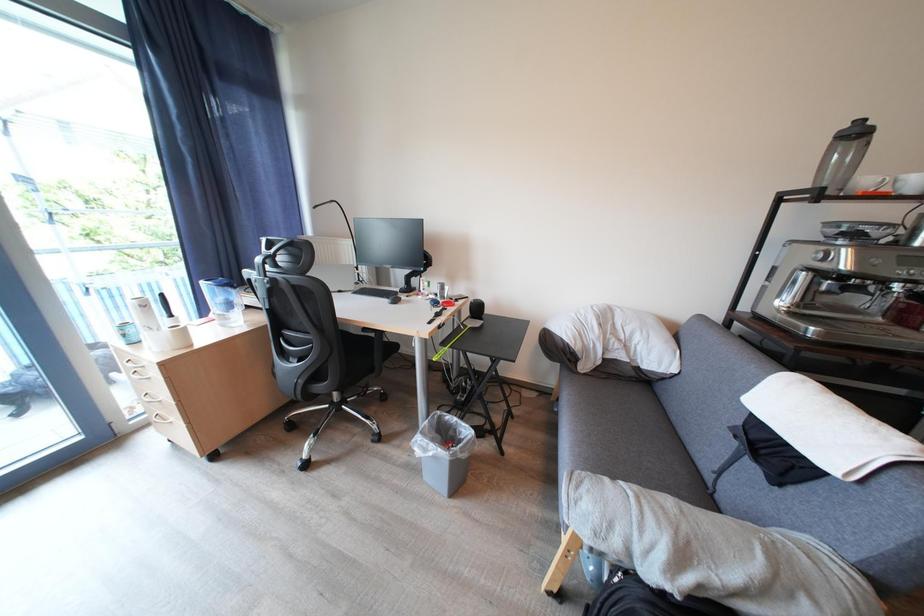
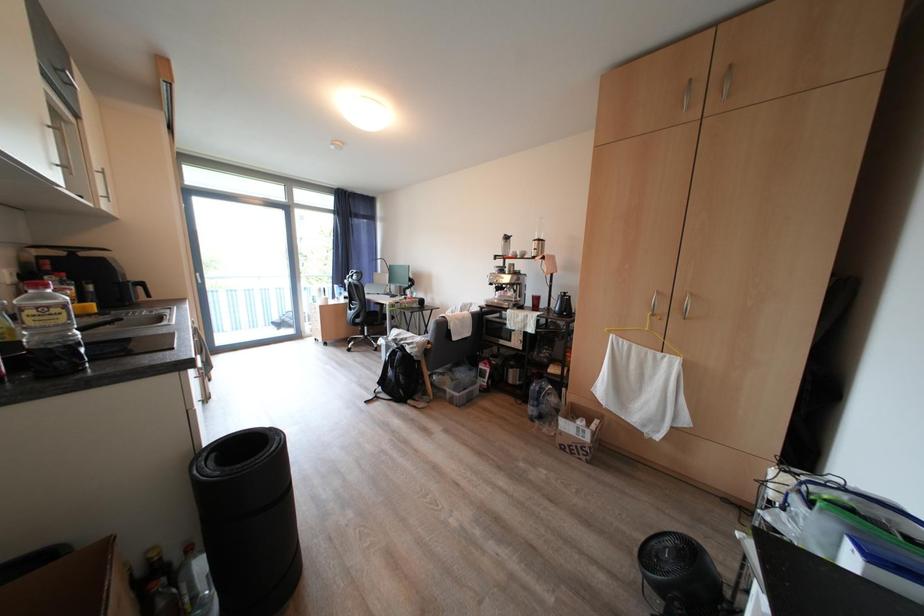
In a continuous first-person perspective shot, in which direction is the camera moving?

The cameraman walked toward right, backward.